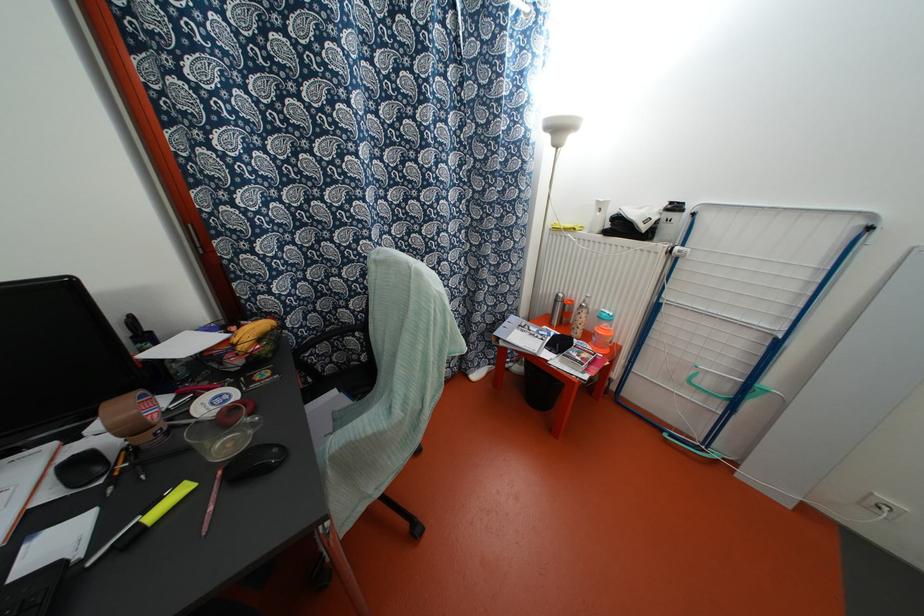
Find where to unscrew the patterned water bottle. Please return your answer as a coordinate pair (x, y).

(579, 317)